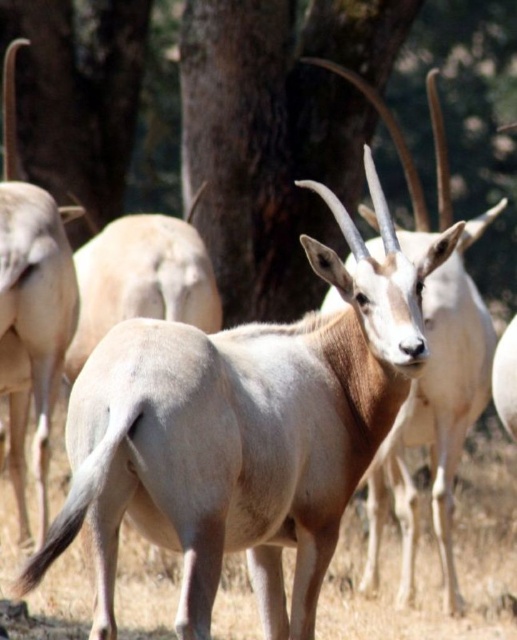
Question: Is brown rough tree at center above light brown fur antelope at center?

Choices:
 (A) yes
 (B) no

Answer: (A)

Question: Is brown rough tree at center closer to the viewer compared to brown rough tree trunk at upper center?

Choices:
 (A) no
 (B) yes

Answer: (B)

Question: Can you confirm if brown rough tree at center is positioned above brown rough tree trunk at upper center?

Choices:
 (A) yes
 (B) no

Answer: (B)

Question: Which point appears closest to the camera in this image?

Choices:
 (A) pyautogui.click(x=448, y=497)
 (B) pyautogui.click(x=361, y=125)

Answer: (A)

Question: Which object is positioned closest to the light brown fur antelope at center?

Choices:
 (A) brown rough tree trunk at upper center
 (B) brown rough tree at center

Answer: (B)

Question: Which point appears farthest from the camera in this image?

Choices:
 (A) (466, 429)
 (B) (114, 134)

Answer: (B)